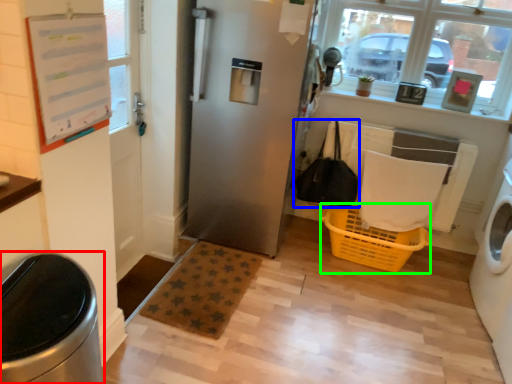
Question: Based on their relative distances, which object is nearer to waste container (highlighted by a red box)? Choose from bag (highlighted by a blue box) and basket (highlighted by a green box).

Choices:
 (A) bag
 (B) basket

Answer: (B)